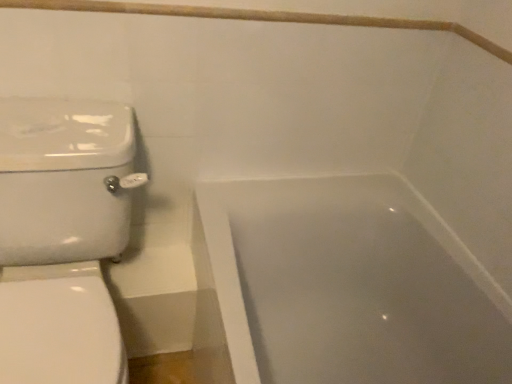
Question: From the image's perspective, does white glossy toilet at left appear higher than wooden balustrade at upper center?

Choices:
 (A) no
 (B) yes

Answer: (A)

Question: Is white glossy toilet at left smaller than wooden balustrade at upper center?

Choices:
 (A) yes
 (B) no

Answer: (B)

Question: From the image's perspective, is white glossy toilet at left located beneath wooden balustrade at upper center?

Choices:
 (A) yes
 (B) no

Answer: (A)

Question: Would you consider white glossy toilet at left to be distant from wooden balustrade at upper center?

Choices:
 (A) yes
 (B) no

Answer: (B)

Question: From a real-world perspective, is white glossy toilet at left physically below wooden balustrade at upper center?

Choices:
 (A) yes
 (B) no

Answer: (A)

Question: Does white glossy toilet at left have a larger size compared to wooden balustrade at upper center?

Choices:
 (A) no
 (B) yes

Answer: (B)

Question: Does wooden balustrade at upper center have a greater width compared to white glossy bathtub at lower right?

Choices:
 (A) no
 (B) yes

Answer: (A)

Question: Can you confirm if wooden balustrade at upper center is taller than white glossy bathtub at lower right?

Choices:
 (A) no
 (B) yes

Answer: (A)

Question: Is wooden balustrade at upper center far from white glossy bathtub at lower right?

Choices:
 (A) yes
 (B) no

Answer: (B)

Question: From the image's perspective, is wooden balustrade at upper center located above white glossy bathtub at lower right?

Choices:
 (A) yes
 (B) no

Answer: (A)

Question: Considering the relative sizes of wooden balustrade at upper center and white glossy bathtub at lower right in the image provided, is wooden balustrade at upper center thinner than white glossy bathtub at lower right?

Choices:
 (A) yes
 (B) no

Answer: (A)

Question: Does wooden balustrade at upper center appear on the left side of white glossy bathtub at lower right?

Choices:
 (A) no
 (B) yes

Answer: (B)

Question: Considering the relative positions of white glossy bathtub at lower right and wooden balustrade at upper center in the image provided, is white glossy bathtub at lower right in front of wooden balustrade at upper center?

Choices:
 (A) yes
 (B) no

Answer: (A)